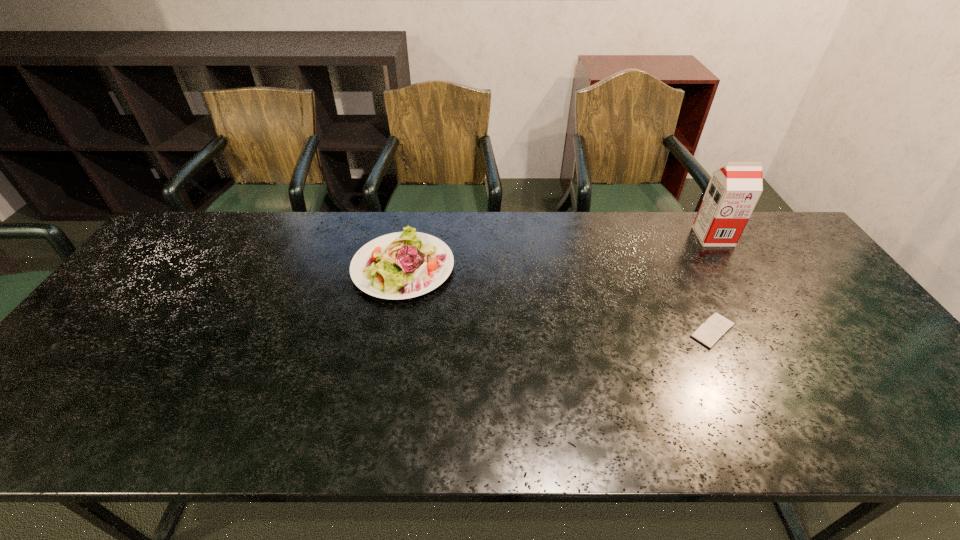
Image resolution: width=960 pixels, height=540 pixels. I want to click on free space in the image that satisfies the following two spatial constraints: 1. on the back side of the rightmost object; 2. on the right side of the salad plate, so click(x=409, y=237).

You are a GUI agent. You are given a task and a screenshot of the screen. Output one action in this format:
    pyautogui.click(x=<x>, y=<y>)
    Task: Click on the free space that satisfies the following two spatial constraints: 1. on the back side of the tallest object; 2. on the left side of the second object from right to left
    This screenshot has height=540, width=960.
    Given the screenshot: What is the action you would take?
    pyautogui.click(x=666, y=237)